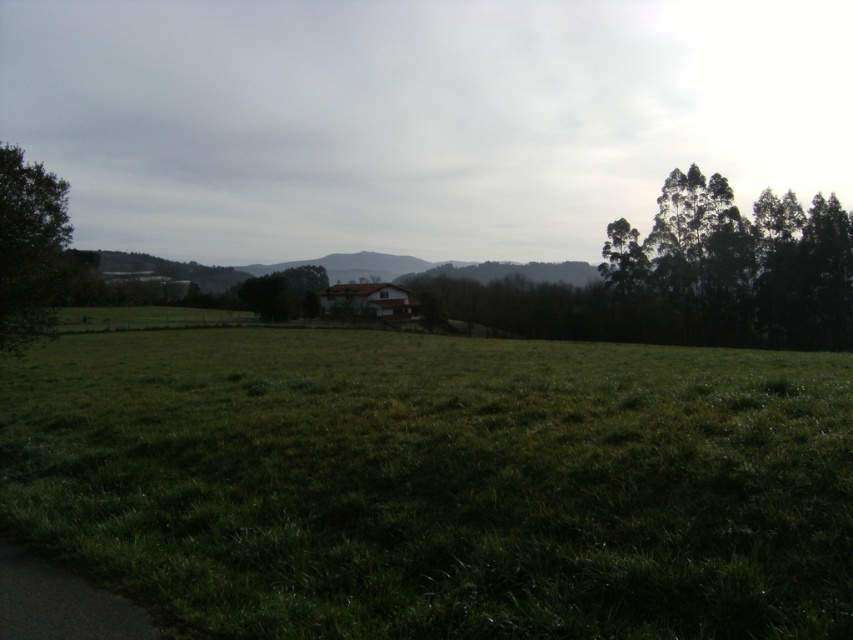
Does green leafy tree at left come behind green leafy tree at center?

No, green leafy tree at left is in front of green leafy tree at center.

You are a GUI agent. You are given a task and a screenshot of the screen. Output one action in this format:
    pyautogui.click(x=<x>, y=<y>)
    Task: Click on the green leafy tree at left
    This screenshot has height=640, width=853.
    Given the screenshot: What is the action you would take?
    pyautogui.click(x=28, y=248)

Is point (10, 339) less distant than point (242, 284)?

Yes, it is.

The image size is (853, 640). What are the coordinates of `green leafy tree at left` in the screenshot? It's located at (28, 248).

Between green grassy field at center and green leafy trees at right, which one is positioned higher?

Positioned higher is green leafy trees at right.

Between green grassy field at center and green leafy trees at right, which one is positioned lower?

green grassy field at center

Is point (283, 483) less distant than point (840, 269)?

Yes, point (283, 483) is closer to viewer.

Locate an element on the screen. The height and width of the screenshot is (640, 853). green grassy field at center is located at coordinates (437, 483).

Does green grassy field at center have a larger size compared to green leafy tree at left?

No, green grassy field at center is not bigger than green leafy tree at left.

Who is positioned more to the right, green grassy field at center or green leafy tree at left?

green grassy field at center is more to the right.

The width and height of the screenshot is (853, 640). Describe the element at coordinates (437, 483) in the screenshot. I see `green grassy field at center` at that location.

Find the location of a particular element. This screenshot has height=640, width=853. green grassy field at center is located at coordinates (437, 483).